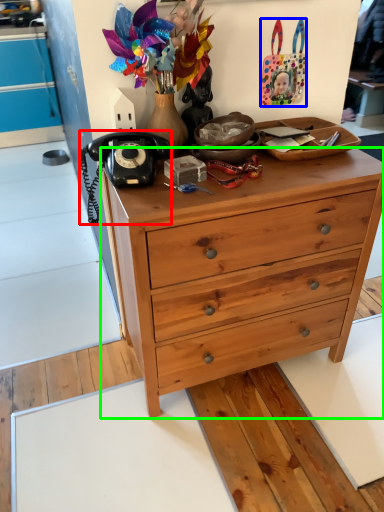
Question: Based on their relative distances, which object is nearer to corded phone (highlighted by a red box)? Choose from handbag (highlighted by a blue box) and desk (highlighted by a green box).

Choices:
 (A) handbag
 (B) desk

Answer: (B)